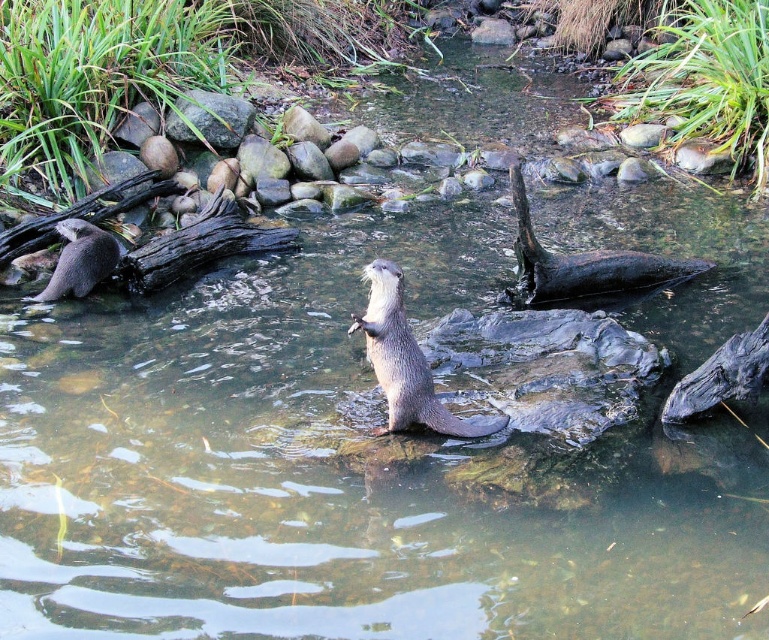
Is gray fur otter at center closer to camera compared to gray fur otter at left?

That is True.

Between point (361, 324) and point (62, 225), which one is positioned behind?

Positioned behind is point (62, 225).

The height and width of the screenshot is (640, 769). Find the location of `gray fur otter at center`. gray fur otter at center is located at coordinates (404, 360).

Between gray fur otter at center and charcoal smooth log at right, which one is positioned lower?

Answer: charcoal smooth log at right is lower down.

Does gray fur otter at center have a greater height compared to charcoal smooth log at right?

Correct, gray fur otter at center is much taller as charcoal smooth log at right.

The height and width of the screenshot is (640, 769). What do you see at coordinates (404, 360) in the screenshot?
I see `gray fur otter at center` at bounding box center [404, 360].

At what (x,y) coordinates should I click in order to perform the action: click on gray fur otter at center. Please return your answer as a coordinate pair (x, y). This screenshot has height=640, width=769. Looking at the image, I should click on (404, 360).

The width and height of the screenshot is (769, 640). What do you see at coordinates (721, 376) in the screenshot? I see `charcoal smooth log at right` at bounding box center [721, 376].

You are a GUI agent. You are given a task and a screenshot of the screen. Output one action in this format:
    pyautogui.click(x=<x>, y=<y>)
    Task: Click on the charcoal smooth log at right
    
    Given the screenshot: What is the action you would take?
    pyautogui.click(x=721, y=376)

Find the location of a particular element. charcoal smooth log at right is located at coordinates (721, 376).